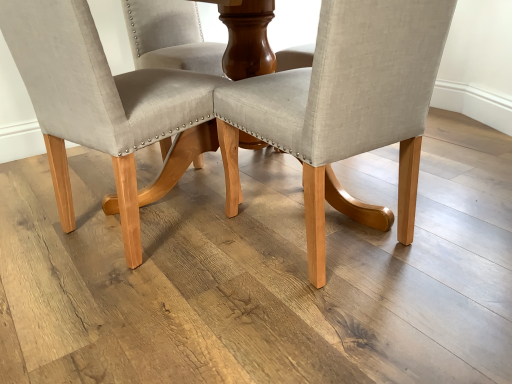
This screenshot has height=384, width=512. I want to click on vacant area that lies between beige fabric chair at center, placed as the 1th chair when sorted from right to left, and beige fabric chair at center, the 2th chair from the right, so click(x=227, y=251).